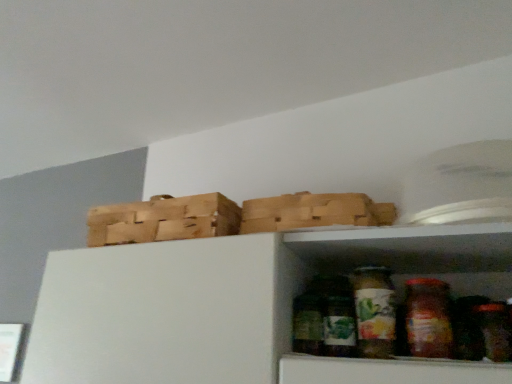
Looking at this image, what is the approximate height of translucent glass jar at center, positioned as the 2th glass jar in left-to-right order?

It is 7.47 inches.

Describe the element at coordinates (374, 311) in the screenshot. I see `green matte glass jar at lower center, the second glass jar in the right-to-left sequence` at that location.

At what (x,y) coordinates should I click in order to perform the action: click on wooden crate at upper left. Please return your answer as a coordinate pair (x, y). The width and height of the screenshot is (512, 384). Looking at the image, I should click on (163, 220).

Where is `translucent glass jar at center, which ranks as the first glass jar in right-to-left order`? translucent glass jar at center, which ranks as the first glass jar in right-to-left order is located at coordinates (428, 318).

Considering the positions of objects green matte glass jar at lower center, positioned as the 1th glass jar in left-to-right order, and wooden crate at upper left in the image provided, who is more to the left, green matte glass jar at lower center, positioned as the 1th glass jar in left-to-right order, or wooden crate at upper left?

Positioned to the left is wooden crate at upper left.

From a real-world perspective, does green matte glass jar at lower center, positioned as the 1th glass jar in left-to-right order, sit lower than wooden crate at upper left?

Yes, from a real-world perspective, green matte glass jar at lower center, positioned as the 1th glass jar in left-to-right order, is below wooden crate at upper left.

Considering the points (394, 293) and (97, 219), which point is in front, point (394, 293) or point (97, 219)?

Positioned in front is point (394, 293).

Is translucent glass jar at center, positioned as the 2th glass jar in left-to-right order, not close to green matte glass jar at lower center, positioned as the 1th glass jar in left-to-right order?

No, translucent glass jar at center, positioned as the 2th glass jar in left-to-right order, is not far from green matte glass jar at lower center, positioned as the 1th glass jar in left-to-right order.

How different are the orientations of translucent glass jar at center, which ranks as the first glass jar in right-to-left order, and green matte glass jar at lower center, positioned as the 1th glass jar in left-to-right order, in degrees?

The angle between the facing direction of translucent glass jar at center, which ranks as the first glass jar in right-to-left order, and the facing direction of green matte glass jar at lower center, positioned as the 1th glass jar in left-to-right order, is 0.00399 degrees.

From a real-world perspective, who is located higher, translucent glass jar at center, positioned as the 2th glass jar in left-to-right order, or green matte glass jar at lower center, the second glass jar in the right-to-left sequence?

translucent glass jar at center, positioned as the 2th glass jar in left-to-right order, from a real-world perspective.

From the image's perspective, is green matte glass jar at lower center, the second glass jar in the right-to-left sequence, over translucent glass jar at center, positioned as the 2th glass jar in left-to-right order?

No.

From a real-world perspective, relative to translucent glass jar at center, positioned as the 2th glass jar in left-to-right order, is green matte glass jar at lower center, positioned as the 1th glass jar in left-to-right order, vertically above or below?

In terms of real-world spatial position, green matte glass jar at lower center, positioned as the 1th glass jar in left-to-right order, is below translucent glass jar at center, positioned as the 2th glass jar in left-to-right order.

Does green matte glass jar at lower center, the second glass jar in the right-to-left sequence, have a lesser height compared to translucent glass jar at center, which ranks as the first glass jar in right-to-left order?

Correct, green matte glass jar at lower center, the second glass jar in the right-to-left sequence, is not as tall as translucent glass jar at center, which ranks as the first glass jar in right-to-left order.

Between green matte glass jar at lower center, the second glass jar in the right-to-left sequence, and translucent glass jar at center, which ranks as the first glass jar in right-to-left order, which one appears on the left side from the viewer's perspective?

From the viewer's perspective, green matte glass jar at lower center, the second glass jar in the right-to-left sequence, appears more on the left side.

Is wooden crate at upper left not near translucent glass jar at center, which ranks as the first glass jar in right-to-left order?

No, wooden crate at upper left is in close proximity to translucent glass jar at center, which ranks as the first glass jar in right-to-left order.

Which is correct: wooden crate at upper left is inside translucent glass jar at center, which ranks as the first glass jar in right-to-left order, or outside of it?

wooden crate at upper left cannot be found inside translucent glass jar at center, which ranks as the first glass jar in right-to-left order.

Which object is positioned more to the right, wooden crate at upper left or translucent glass jar at center, which ranks as the first glass jar in right-to-left order?

translucent glass jar at center, which ranks as the first glass jar in right-to-left order, is more to the right.

Is wooden crate at upper left located outside green matte glass jar at lower center, positioned as the 1th glass jar in left-to-right order?

Yes, wooden crate at upper left is not within green matte glass jar at lower center, positioned as the 1th glass jar in left-to-right order.

Is wooden crate at upper left turned away from green matte glass jar at lower center, the second glass jar in the right-to-left sequence?

No, wooden crate at upper left is not facing away from green matte glass jar at lower center, the second glass jar in the right-to-left sequence.

Can you tell me how much wooden crate at upper left and green matte glass jar at lower center, the second glass jar in the right-to-left sequence, differ in facing direction?

The angular difference between wooden crate at upper left and green matte glass jar at lower center, the second glass jar in the right-to-left sequence, is 0.00293 degrees.

How many degrees apart are the facing directions of translucent glass jar at center, which ranks as the first glass jar in right-to-left order, and wooden crate at upper left?

They differ by 0.0011 degrees in their facing directions.

Looking at this image, between translucent glass jar at center, positioned as the 2th glass jar in left-to-right order, and wooden crate at upper left, which one has larger width?

wooden crate at upper left is wider.

Are translucent glass jar at center, positioned as the 2th glass jar in left-to-right order, and wooden crate at upper left making contact?

No, translucent glass jar at center, positioned as the 2th glass jar in left-to-right order, is not in contact with wooden crate at upper left.

From the image's perspective, is translucent glass jar at center, positioned as the 2th glass jar in left-to-right order, above wooden crate at upper left?

No.

The width and height of the screenshot is (512, 384). I want to click on basket that appears on the left of green matte glass jar at lower center, positioned as the 1th glass jar in left-to-right order, so click(x=163, y=220).

Identify the location of glass jar above the green matte glass jar at lower center, positioned as the 1th glass jar in left-to-right order (from the image's perspective). Image resolution: width=512 pixels, height=384 pixels. (428, 318).

Looking at the image, which one is located further to green matte glass jar at lower center, the second glass jar in the right-to-left sequence, wooden crate at upper left or translucent glass jar at center, positioned as the 2th glass jar in left-to-right order?

wooden crate at upper left.

From the image, which object appears to be farther from wooden crate at upper left, green matte glass jar at lower center, positioned as the 1th glass jar in left-to-right order, or translucent glass jar at center, which ranks as the first glass jar in right-to-left order?

translucent glass jar at center, which ranks as the first glass jar in right-to-left order.

Considering their positions, is translucent glass jar at center, positioned as the 2th glass jar in left-to-right order, positioned closer to wooden crate at upper left than green matte glass jar at lower center, positioned as the 1th glass jar in left-to-right order?

green matte glass jar at lower center, positioned as the 1th glass jar in left-to-right order, is positioned closer to the anchor wooden crate at upper left.

Looking at the image, which one is located closer to translucent glass jar at center, positioned as the 2th glass jar in left-to-right order, green matte glass jar at lower center, positioned as the 1th glass jar in left-to-right order, or wooden crate at upper left?

green matte glass jar at lower center, positioned as the 1th glass jar in left-to-right order, lies closer to translucent glass jar at center, positioned as the 2th glass jar in left-to-right order, than the other object.

When comparing their distances from translucent glass jar at center, positioned as the 2th glass jar in left-to-right order, does wooden crate at upper left or green matte glass jar at lower center, positioned as the 1th glass jar in left-to-right order, seem further?

wooden crate at upper left is further to translucent glass jar at center, positioned as the 2th glass jar in left-to-right order.

Which object lies nearer to the anchor point green matte glass jar at lower center, positioned as the 1th glass jar in left-to-right order, translucent glass jar at center, which ranks as the first glass jar in right-to-left order, or wooden crate at upper left?

Based on the image, translucent glass jar at center, which ranks as the first glass jar in right-to-left order, appears to be nearer to green matte glass jar at lower center, positioned as the 1th glass jar in left-to-right order.

The image size is (512, 384). In order to click on glass jar situated between wooden crate at upper left and translucent glass jar at center, which ranks as the first glass jar in right-to-left order, from left to right in this screenshot , I will do `click(374, 311)`.